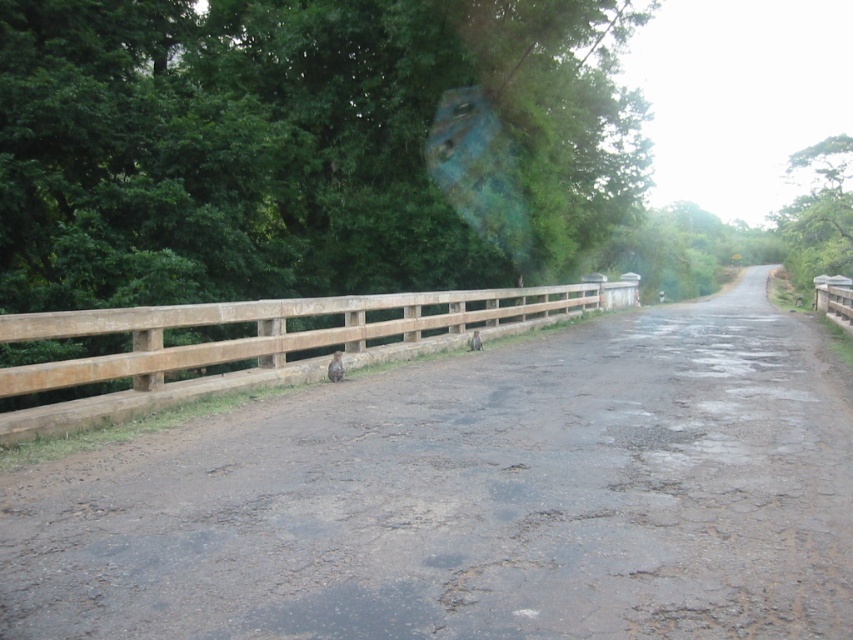
Question: Can you confirm if brown rough dirt track at center is smaller than brown wooden fence at center?

Choices:
 (A) yes
 (B) no

Answer: (A)

Question: Which of the following is the farthest from the observer?

Choices:
 (A) (383, 337)
 (B) (88, 563)

Answer: (A)

Question: Which object appears farthest from the camera in this image?

Choices:
 (A) brown wooden fence at center
 (B) brown rough dirt track at center

Answer: (A)

Question: Is brown rough dirt track at center to the right of brown wooden fence at center from the viewer's perspective?

Choices:
 (A) yes
 (B) no

Answer: (A)

Question: Which point is closer to the camera?

Choices:
 (A) [42, 564]
 (B) [68, 385]

Answer: (A)

Question: Does brown rough dirt track at center have a smaller size compared to brown wooden fence at center?

Choices:
 (A) no
 (B) yes

Answer: (B)